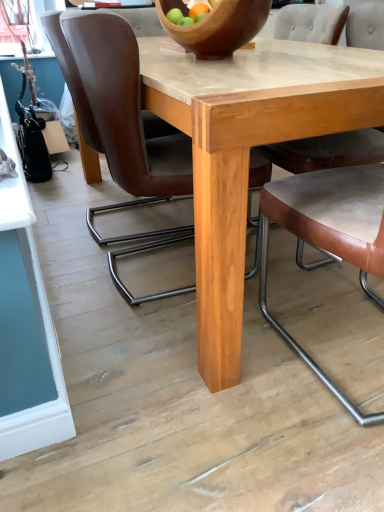
Question: Does brown leather chair at center, acting as the 2th chair starting from the left, have a greater height compared to brown leather chair at center, the 1th chair in the left-to-right sequence?

Choices:
 (A) yes
 (B) no

Answer: (A)

Question: Is brown leather chair at center, acting as the 2th chair starting from the left, oriented away from brown leather chair at center, the 1th chair in the left-to-right sequence?

Choices:
 (A) yes
 (B) no

Answer: (B)

Question: Is brown leather chair at center, the third chair viewed from the right, completely or partially outside of brown leather chair at center, which ranks as the fourth chair in right-to-left order?

Choices:
 (A) no
 (B) yes

Answer: (B)

Question: Would you say brown leather chair at center, which ranks as the fourth chair in right-to-left order, is part of brown leather chair at center, the third chair viewed from the right,'s contents?

Choices:
 (A) yes
 (B) no

Answer: (B)

Question: Is the position of brown leather chair at center, acting as the 2th chair starting from the left, more distant than that of brown leather chair at center, the 1th chair in the left-to-right sequence?

Choices:
 (A) yes
 (B) no

Answer: (B)

Question: From a real-world perspective, is brown leather chair at center, which is counted as the second chair, starting from the right, positioned above or below natural wood table at center?

Choices:
 (A) below
 (B) above

Answer: (B)

Question: In terms of height, does brown leather chair at center, which is counted as the second chair, starting from the right, look taller or shorter compared to natural wood table at center?

Choices:
 (A) short
 (B) tall

Answer: (B)

Question: Is brown leather chair at center, which is counted as the second chair, starting from the right, wider or thinner than natural wood table at center?

Choices:
 (A) wide
 (B) thin

Answer: (B)

Question: Based on their sizes in the image, would you say brown leather chair at center, which is counted as the second chair, starting from the right, is bigger or smaller than natural wood table at center?

Choices:
 (A) small
 (B) big

Answer: (A)

Question: From a real-world perspective, is wooden bowl at center physically located above or below brown leather chair at center, arranged as the third chair when viewed from the left?

Choices:
 (A) above
 (B) below

Answer: (A)

Question: Is wooden bowl at center spatially inside brown leather chair at center, arranged as the third chair when viewed from the left, or outside of it?

Choices:
 (A) inside
 (B) outside

Answer: (B)

Question: From the image's perspective, relative to brown leather chair at center, which is counted as the second chair, starting from the right, is wooden bowl at center above or below?

Choices:
 (A) below
 (B) above

Answer: (B)

Question: Does point (228, 13) appear closer or farther from the camera than point (311, 362)?

Choices:
 (A) closer
 (B) farther

Answer: (A)

Question: Based on their sizes in the image, would you say brown leather chair at center, marked as the 4th chair in a left-to-right arrangement, is bigger or smaller than brown leather chair at center, which ranks as the fourth chair in right-to-left order?

Choices:
 (A) small
 (B) big

Answer: (B)

Question: From the image's perspective, is brown leather chair at center, marked as the 4th chair in a left-to-right arrangement, positioned above or below brown leather chair at center, which ranks as the fourth chair in right-to-left order?

Choices:
 (A) below
 (B) above

Answer: (A)